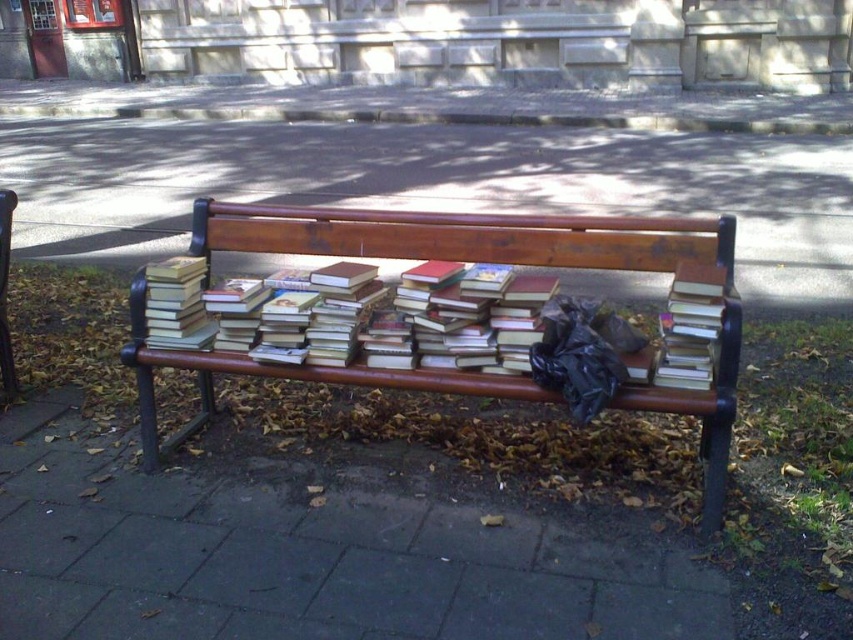
You are trying to place a small potted plant on top of the brown wooden bench at center. The potted plant is as tall as the hardcover book at center. Will the plant be visible from above the bench?

The brown wooden bench at center has a greater height compared to the hardcover book at center. Since the potted plant is as tall as the hardcover book at center, it will not be visible from above the bench because the bench is taller than the plant.

You are a person trying to sit on the brown wooden bench at center. However, there is a hardcover book at center in your way. Can you move the book to the side to make space?

The brown wooden bench at center is located above the hardcover book at center, so the book is under the bench. Since the book is already under the bench, you don not need to move it to sit.

You are standing in front of the brown wooden bench at center and want to place a new book on the hardcover books at center. Which object is closer to you so you can reach it first?

The brown wooden bench at center is closer to you than the hardcover books at center, so you can reach it first.